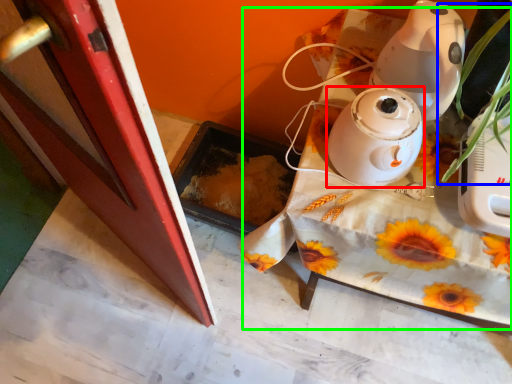
Question: Based on their relative distances, which object is farther from home appliance (highlighted by a red box)? Choose from plant (highlighted by a blue box) and table (highlighted by a green box).

Choices:
 (A) plant
 (B) table

Answer: (B)